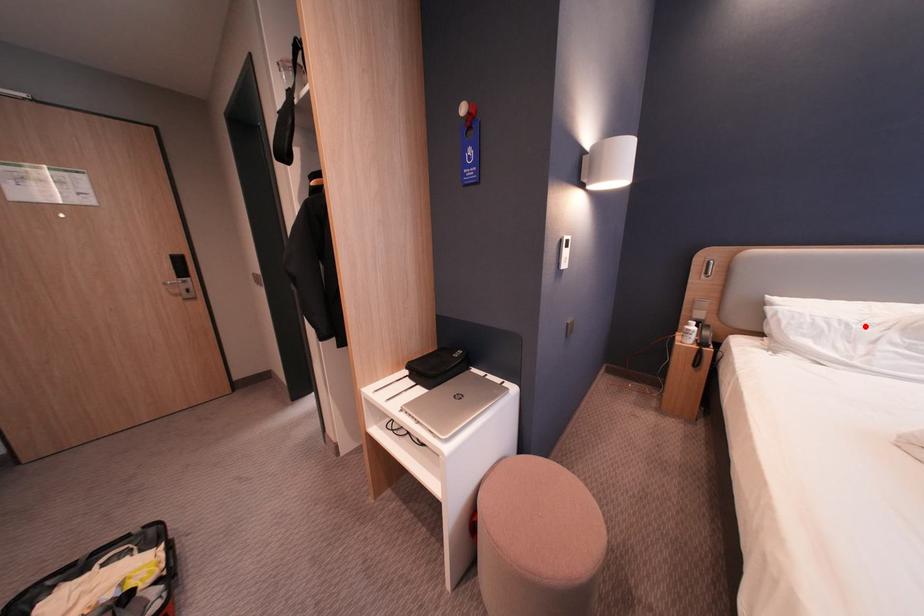
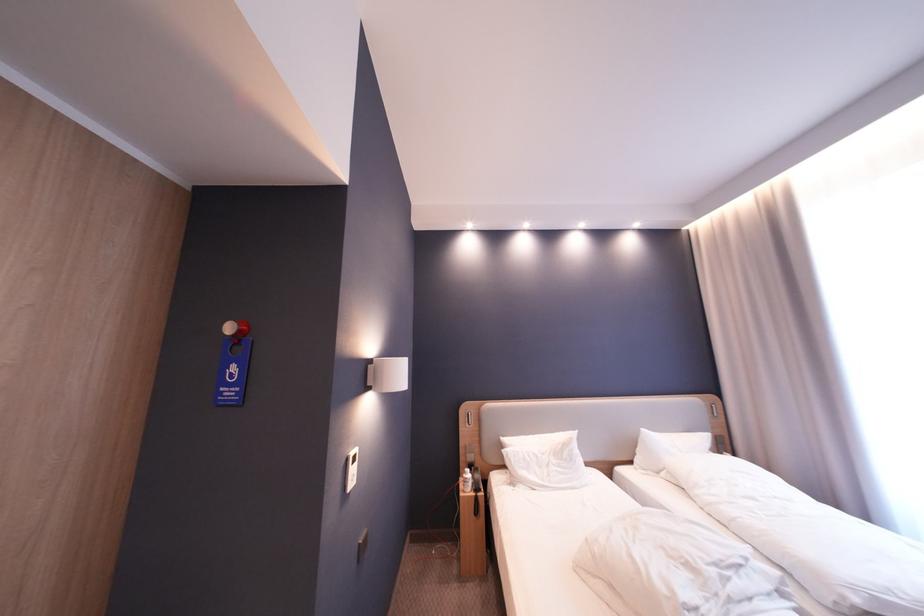
In the second image, find the point that corresponds to the highlighted location in the first image.

(550, 456)